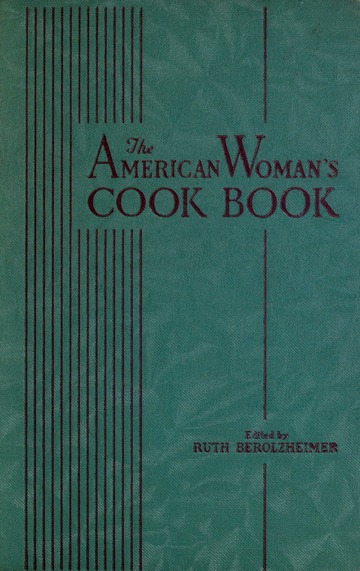
At what (x,y) coordinates should I click in order to perform the action: click on book. Please return your answer as a coordinate pair (x, y). Looking at the image, I should click on (197, 289).